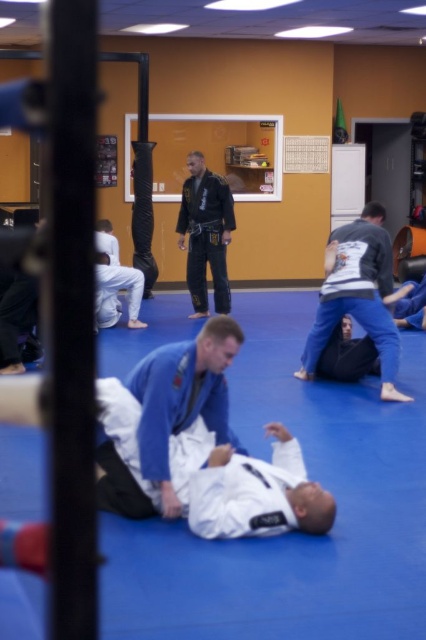
Is blue fabric mat at center below black matte uniform at center?

Yes, blue fabric mat at center is below black matte uniform at center.

Looking at this image, can you confirm if blue fabric mat at center is bigger than black matte uniform at center?

Yes, blue fabric mat at center is bigger than black matte uniform at center.

In order to click on blue fabric mat at center in this screenshot , I will do `click(359, 294)`.

Locate an element on the screen. This screenshot has height=640, width=426. blue fabric mat at center is located at coordinates (359, 294).